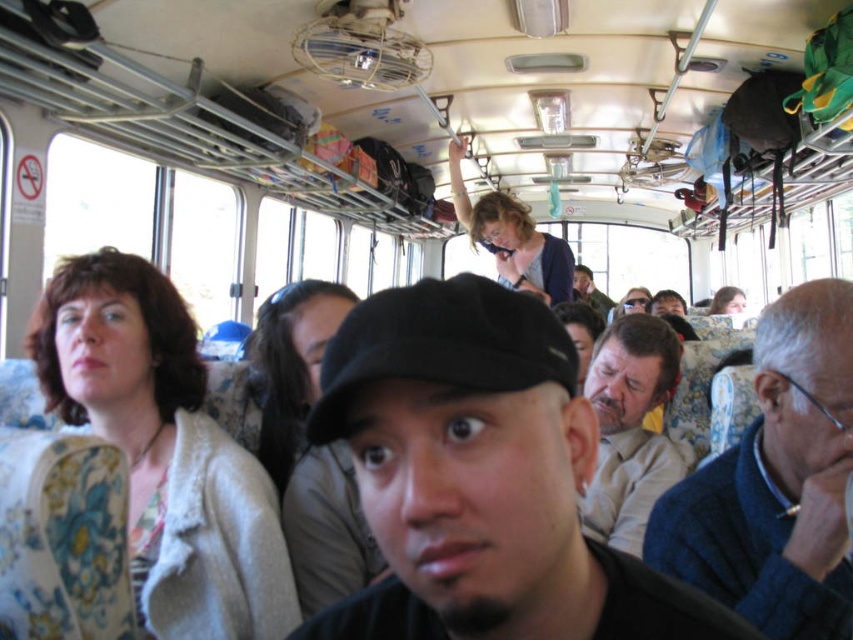
Question: Does floral fabric jacket at left lie in front of blue sweater at right?

Choices:
 (A) no
 (B) yes

Answer: (A)

Question: Is floral fabric jacket at left above blue sweater at right?

Choices:
 (A) no
 (B) yes

Answer: (A)

Question: Among these points, which one is nearest to the camera?

Choices:
 (A) (497, 317)
 (B) (165, 573)
 (C) (659, 472)
 (D) (837, 577)

Answer: (A)

Question: Which of the following is the farthest from the observer?

Choices:
 (A) floral fabric jacket at left
 (B) dark brown leather jacket at upper center
 (C) blue sweater at right
 (D) black matte cap at center

Answer: (B)

Question: Estimate the real-world distances between objects in this image. Which object is farther from the blue sweater at right?

Choices:
 (A) light beige shirt at center
 (B) dark brown leather jacket at upper center
 (C) black matte cap at center
 (D) floral fabric jacket at left

Answer: (B)

Question: Does blue sweater at right have a smaller size compared to dark brown leather jacket at upper center?

Choices:
 (A) yes
 (B) no

Answer: (A)